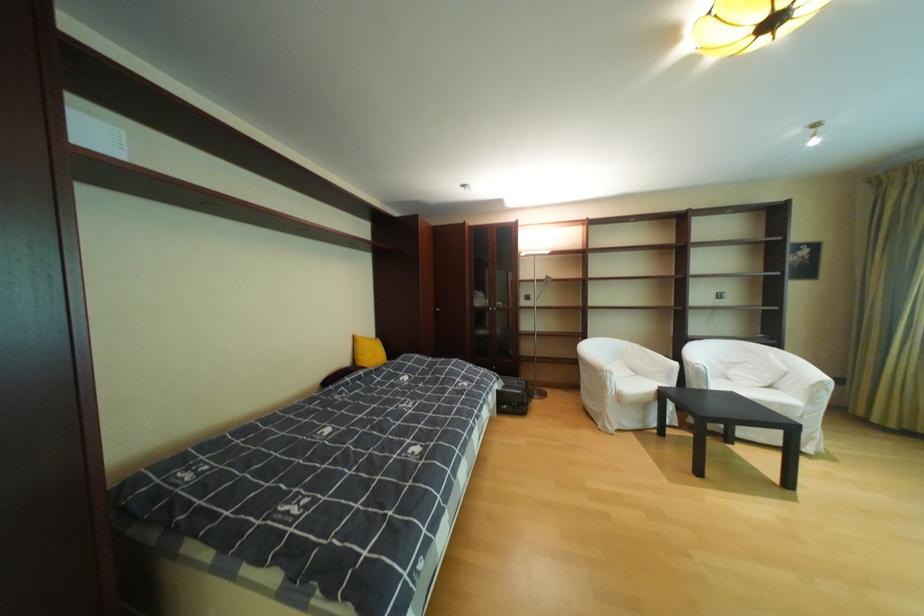
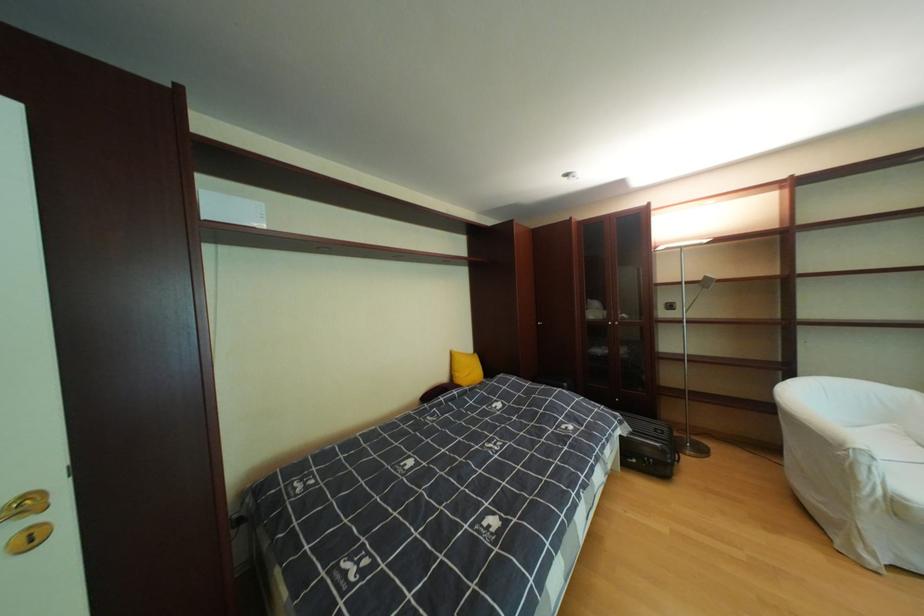
Where in the second image is the point corresponding to point 526,405 from the first image?

(661, 461)